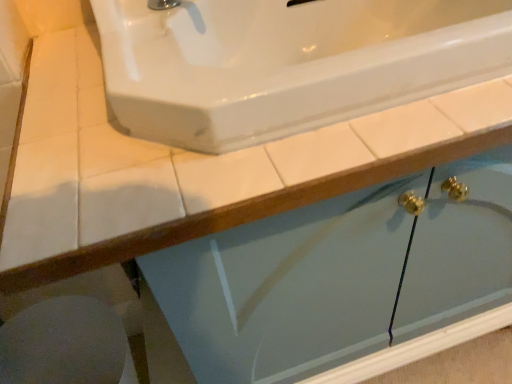
Question: Could you tell me if white glossy porcelain at lower left is turned towards white glossy sink at upper center?

Choices:
 (A) no
 (B) yes

Answer: (A)

Question: Is the depth of white glossy porcelain at lower left greater than that of white glossy sink at upper center?

Choices:
 (A) yes
 (B) no

Answer: (A)

Question: From the image's perspective, is white glossy porcelain at lower left below white glossy sink at upper center?

Choices:
 (A) no
 (B) yes

Answer: (B)

Question: From the image's perspective, would you say white glossy porcelain at lower left is positioned over white glossy sink at upper center?

Choices:
 (A) no
 (B) yes

Answer: (A)

Question: Would you consider white glossy porcelain at lower left to be distant from white glossy sink at upper center?

Choices:
 (A) no
 (B) yes

Answer: (A)

Question: Can you confirm if white glossy porcelain at lower left is smaller than white glossy sink at upper center?

Choices:
 (A) yes
 (B) no

Answer: (A)

Question: Considering the relative sizes of white glossy sink at upper center and white glossy porcelain at lower left in the image provided, is white glossy sink at upper center thinner than white glossy porcelain at lower left?

Choices:
 (A) no
 (B) yes

Answer: (A)

Question: Does white glossy sink at upper center appear on the left side of white glossy porcelain at lower left?

Choices:
 (A) yes
 (B) no

Answer: (B)

Question: Is white glossy sink at upper center far from white glossy porcelain at lower left?

Choices:
 (A) no
 (B) yes

Answer: (A)

Question: Does white glossy sink at upper center appear on the right side of white glossy porcelain at lower left?

Choices:
 (A) yes
 (B) no

Answer: (A)

Question: Does white glossy sink at upper center lie in front of white glossy porcelain at lower left?

Choices:
 (A) no
 (B) yes

Answer: (B)

Question: From the image's perspective, is white glossy sink at upper center below white glossy porcelain at lower left?

Choices:
 (A) yes
 (B) no

Answer: (B)

Question: In terms of height, does white glossy porcelain at lower left look taller or shorter compared to white glossy sink at upper center?

Choices:
 (A) short
 (B) tall

Answer: (B)